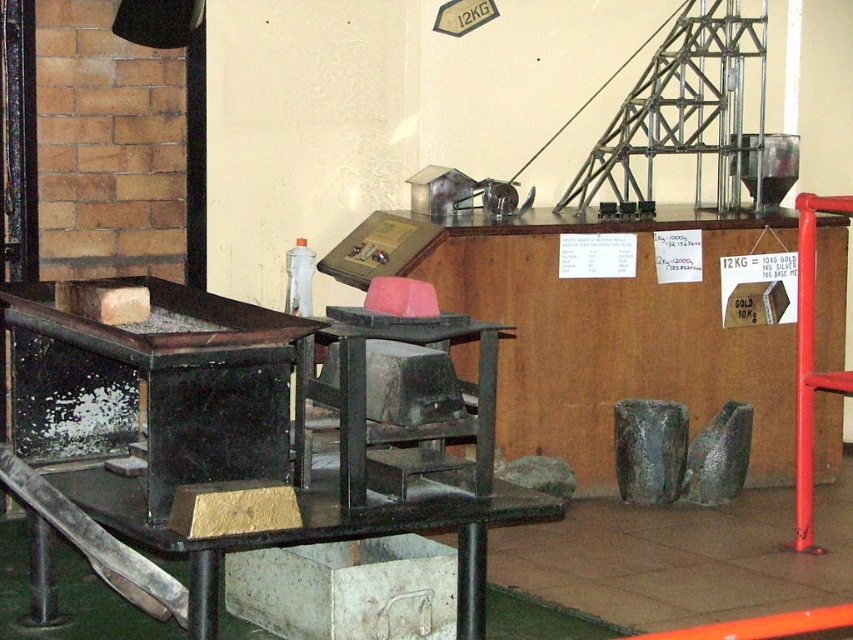
You are a visitor at the museum and want to take a photo of the metallic gray machine at center and the metallic gray table at lower left. Which object should you focus on first if you want to capture both in one frame without moving the camera?

You should focus on the metallic gray machine at center first because it is larger in size compared to the metallic gray table at lower left, making it more prominent in the frame.